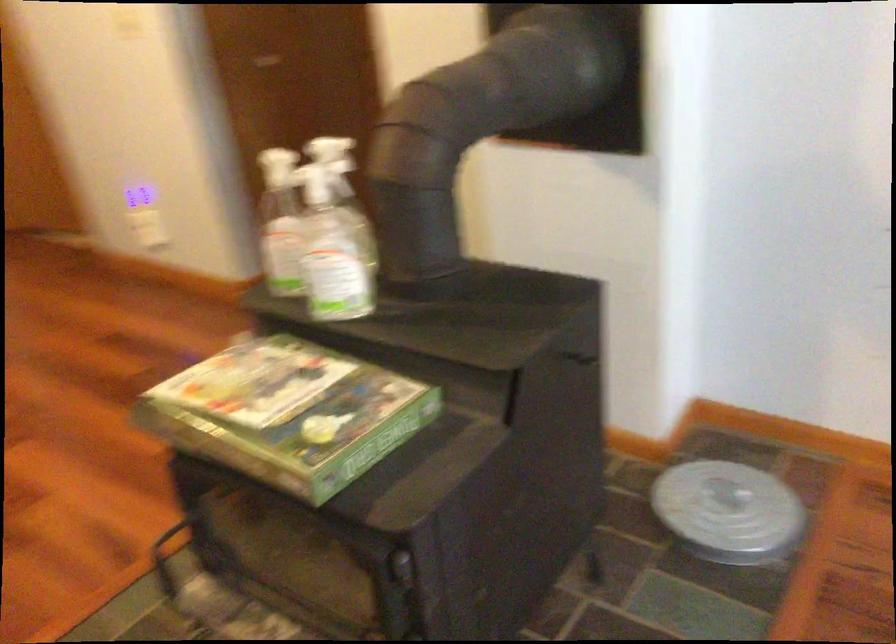
Locate an element on the screen. The height and width of the screenshot is (644, 896). stove door handle is located at coordinates (401, 567).